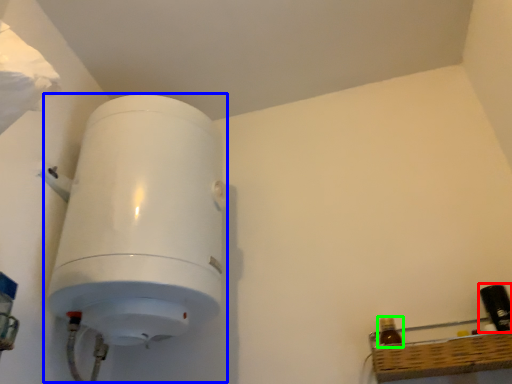
Question: Which object is positioned farthest from bottle (highlighted by a red box)? Select from appliance (highlighted by a blue box) and bottle (highlighted by a green box).

Choices:
 (A) appliance
 (B) bottle

Answer: (A)